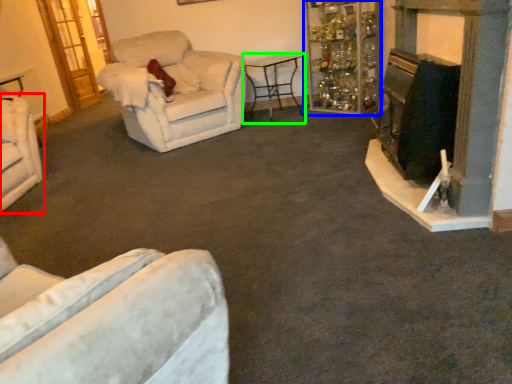
Question: Based on their relative distances, which object is nearer to chair (highlighted by a red box)? Choose from shelf (highlighted by a blue box) and table (highlighted by a green box).

Choices:
 (A) shelf
 (B) table

Answer: (B)